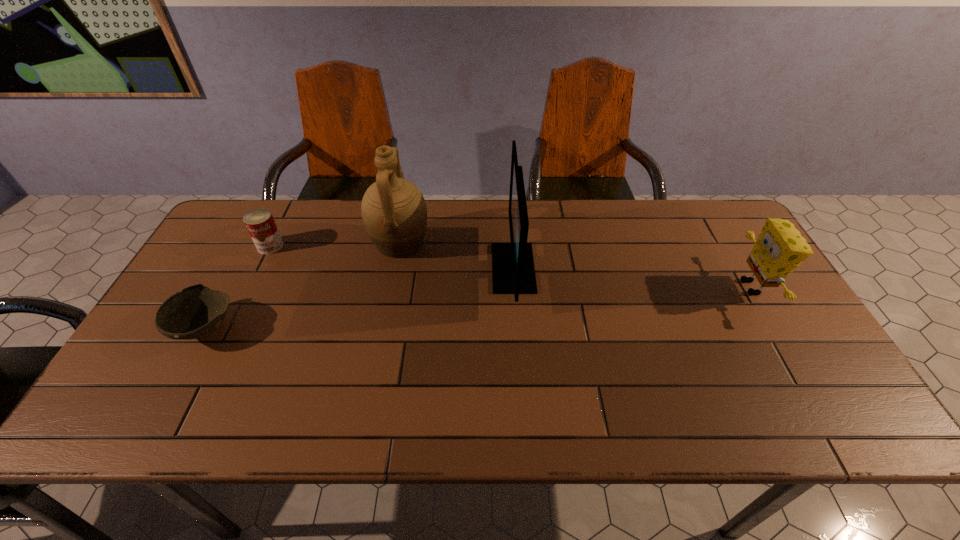
Locate an element on the screen. The height and width of the screenshot is (540, 960). the third object from right to left is located at coordinates (394, 212).

Where is `monitor`? monitor is located at coordinates (513, 272).

You are a GUI agent. You are given a task and a screenshot of the screen. Output one action in this format:
    pyautogui.click(x=<x>, y=<y>)
    Task: Click on the sponge
    This screenshot has width=960, height=540.
    Given the screenshot: What is the action you would take?
    pyautogui.click(x=780, y=248)

Where is `the rightmost object`? This screenshot has height=540, width=960. the rightmost object is located at coordinates (780, 248).

I want to click on can, so click(260, 223).

Where is `the shortest object`? The width and height of the screenshot is (960, 540). the shortest object is located at coordinates (197, 311).

The height and width of the screenshot is (540, 960). Identify the location of free location located 0.230m on the front of the pitcher. (384, 329).

This screenshot has width=960, height=540. What are the coordinates of `vacant space situated on the screen side of the second object from right to left` in the screenshot? It's located at (362, 268).

At what (x,y) coordinates should I click in order to perform the action: click on free space located 0.060m on the screen side of the second object from right to left. Please return your answer as a coordinate pair (x, y). The width and height of the screenshot is (960, 540). Looking at the image, I should click on (471, 268).

At what (x,y) coordinates should I click in order to perform the action: click on free space located 0.140m on the screen side of the second object from right to left. Please return your answer as a coordinate pair (x, y). The image size is (960, 540). Looking at the image, I should click on (444, 268).